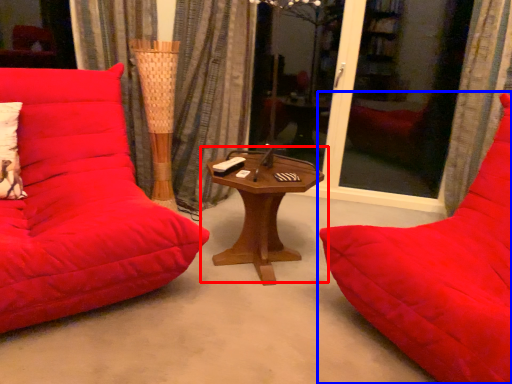
Question: Which point is further to the camera, table (highlighted by a red box) or studio couch (highlighted by a blue box)?

Choices:
 (A) table
 (B) studio couch

Answer: (A)